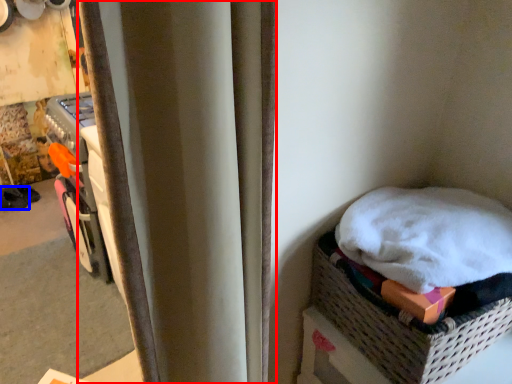
Question: Which object is further to the camera taking this photo, curtain (highlighted by a red box) or footwear (highlighted by a blue box)?

Choices:
 (A) curtain
 (B) footwear

Answer: (B)